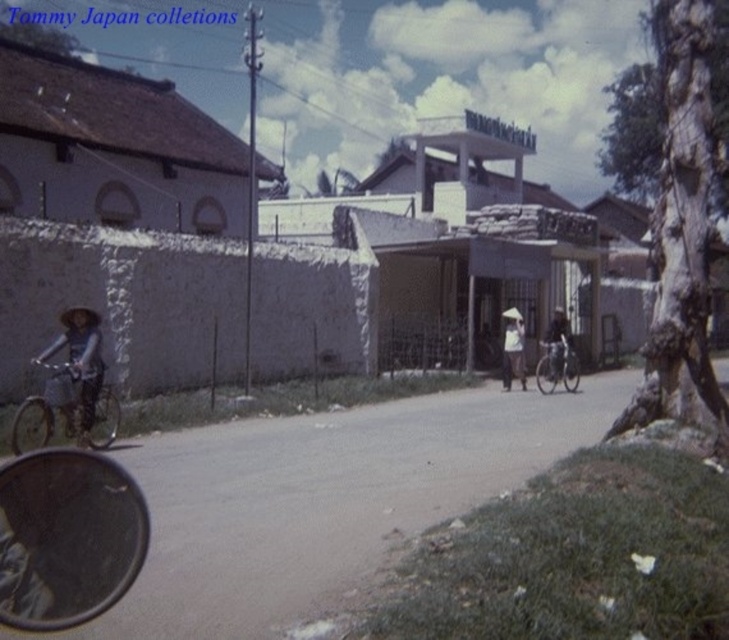
You are a GUI agent. You are given a task and a screenshot of the screen. Output one action in this format:
    pyautogui.click(x=<x>, y=<y>)
    Task: Click on the metallic silver bicycle at left
    
    Given the screenshot: What is the action you would take?
    pyautogui.click(x=47, y=410)

Is metallic silver bicycle at left closer to camera compared to metallic silver bicycle at center-right?

Yes, metallic silver bicycle at left is closer to the viewer.

In order to click on metallic silver bicycle at left in this screenshot , I will do `click(47, 410)`.

This screenshot has width=729, height=640. Identify the location of metallic silver bicycle at left. pyautogui.click(x=47, y=410).

Who is shorter, matte gray bicycle at left or metallic silver bicycle at center-right?

metallic silver bicycle at center-right

The height and width of the screenshot is (640, 729). I want to click on matte gray bicycle at left, so click(x=79, y=360).

Does matte gray bicycle at left appear on the right side of white cloth hat at center?

Incorrect, matte gray bicycle at left is not on the right side of white cloth hat at center.

Can you confirm if matte gray bicycle at left is positioned to the left of white cloth hat at center?

Yes, matte gray bicycle at left is to the left of white cloth hat at center.

Is point (93, 401) positioned in front of point (523, 340)?

Yes, point (93, 401) is in front of point (523, 340).

Image resolution: width=729 pixels, height=640 pixels. Find the location of `matte gray bicycle at left`. matte gray bicycle at left is located at coordinates [x=79, y=360].